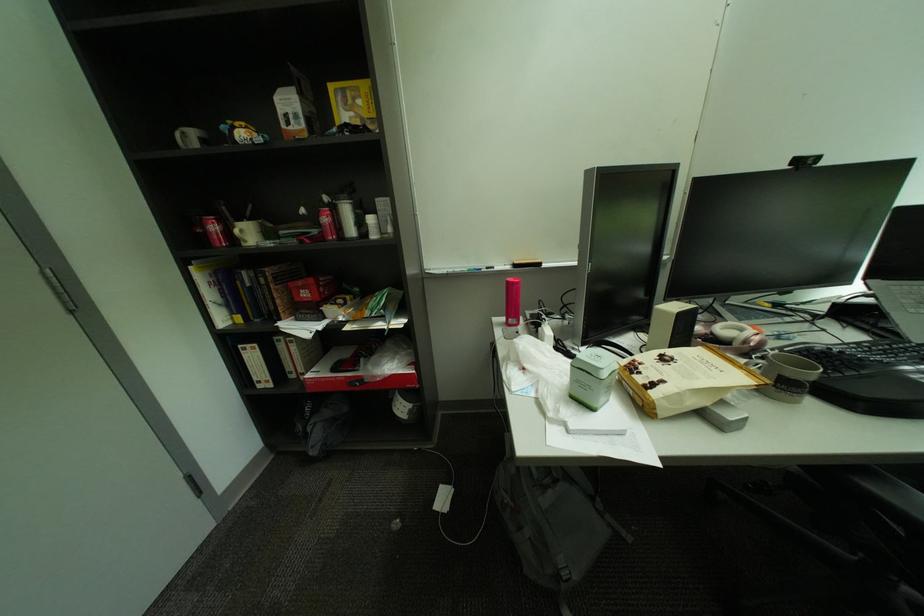
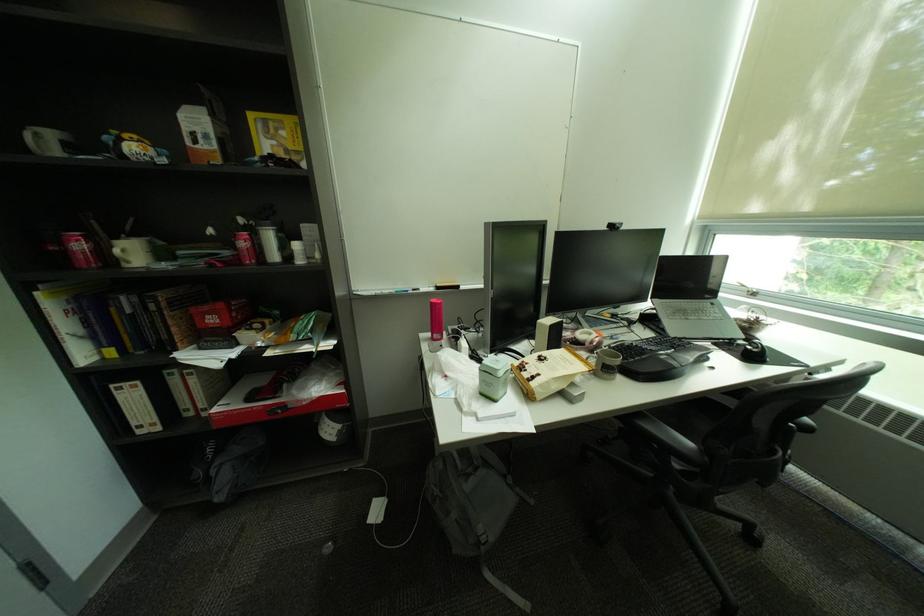
Question: The images are taken continuously from a first-person perspective. In which direction is your viewpoint rotating?

Choices:
 (A) Left
 (B) Right
 (C) Up
 (D) Down

Answer: (B)